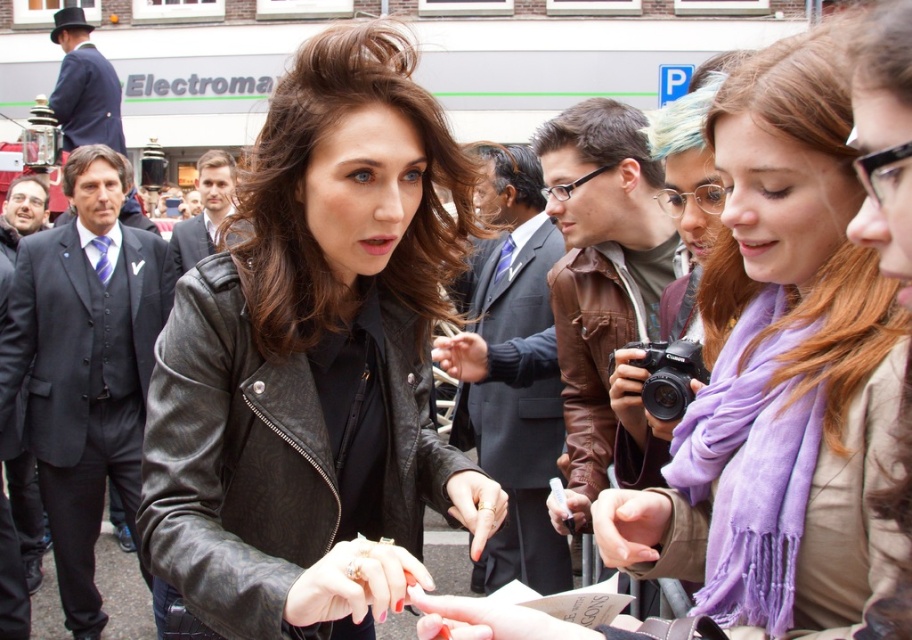
Question: Which point appears closest to the camera in this image?

Choices:
 (A) (195, 285)
 (B) (775, 554)

Answer: (B)

Question: Can you confirm if black leather jacket at center is wider than purple scarf at center?

Choices:
 (A) yes
 (B) no

Answer: (A)

Question: Which of the following is the farthest from the observer?

Choices:
 (A) (846, 620)
 (B) (314, 461)

Answer: (B)

Question: Which of the following is the closest to the observer?

Choices:
 (A) (250, 292)
 (B) (842, 184)

Answer: (B)

Question: Where is black leather jacket at center located in relation to purple scarf at center in the image?

Choices:
 (A) left
 (B) right

Answer: (A)

Question: Is black leather jacket at center wider than purple scarf at center?

Choices:
 (A) yes
 (B) no

Answer: (A)